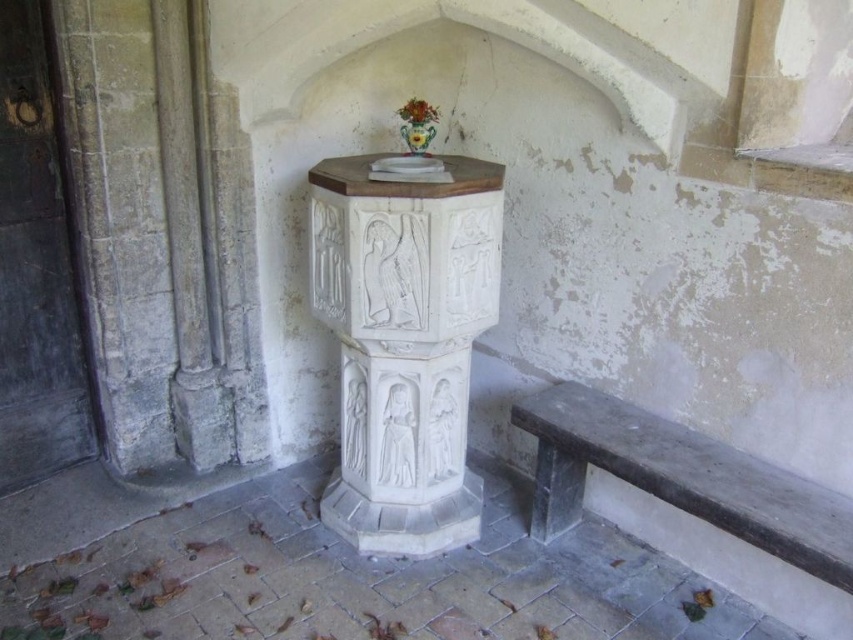
You are standing in front of the baptismal font in the historic church. You notice two points marked on the wall behind the font at coordinates point (434, 132) and point (421, 109). If you want to place a small plaque closer to the camera, which point should you choose?

You should choose point (434, 132) because it is further to the camera than point (421, 109), making it closer to your position.

You are standing in the historic church interior and want to place a small bouquet of flowers in the green glazed vase at center. Where exactly should you go to find the vase?

The green glazed vase at center is located at point (416, 134).